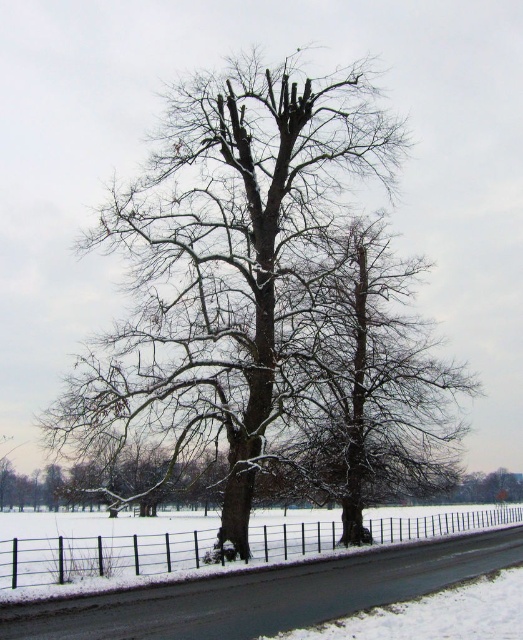
Can you confirm if snow-covered tree at center is wider than black metal fence at lower center?

No.

Between snow-covered tree at center and black metal fence at lower center, which one has more height?

With more height is snow-covered tree at center.

This screenshot has width=523, height=640. Describe the element at coordinates (369, 388) in the screenshot. I see `snow-covered tree at center` at that location.

Identify the location of snow-covered tree at center. (x=369, y=388).